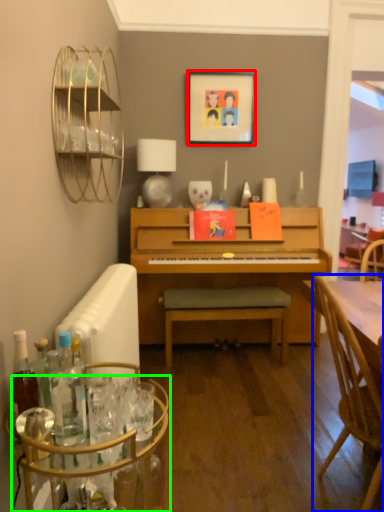
Question: Based on their relative distances, which object is farther from picture frame (highlighted by a red box)? Choose from chair (highlighted by a blue box) and glass table (highlighted by a green box).

Choices:
 (A) chair
 (B) glass table

Answer: (B)